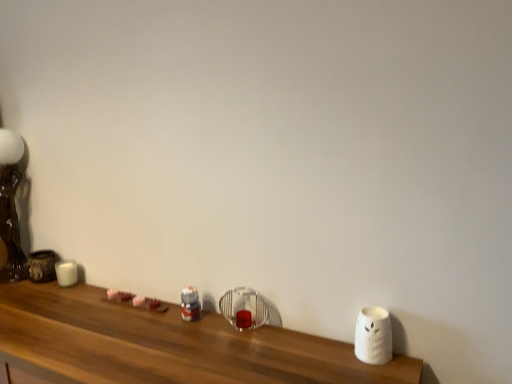
Image resolution: width=512 pixels, height=384 pixels. Describe the element at coordinates (166, 345) in the screenshot. I see `white matte vase at lower right` at that location.

Where is `white matte vase at lower right`? Image resolution: width=512 pixels, height=384 pixels. white matte vase at lower right is located at coordinates (166, 345).

Locate an element on the screen. This screenshot has height=384, width=512. white matte vase at lower right is located at coordinates (166, 345).